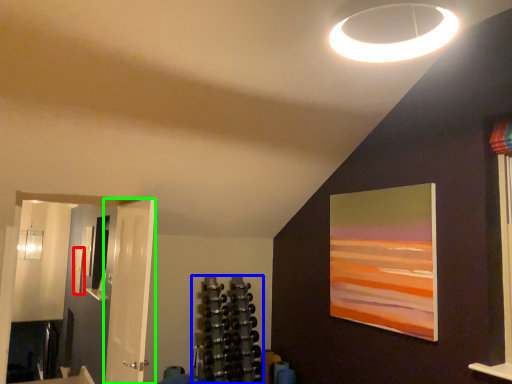
Question: Which is nearer to the picture frame (highlighted by a red box)? shelf (highlighted by a blue box) or door (highlighted by a green box).

Choices:
 (A) shelf
 (B) door

Answer: (A)